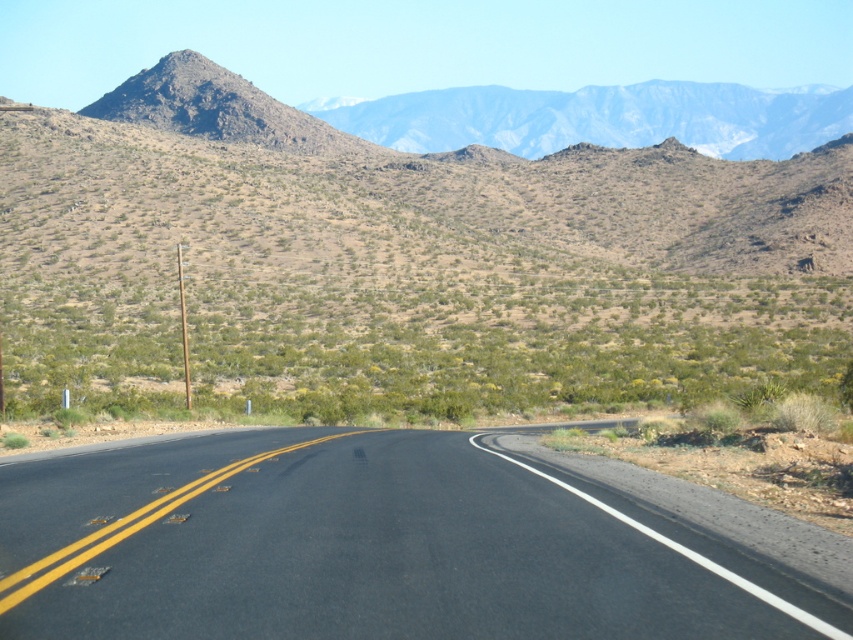
Question: Is black asphalt road at center below rugged rock mountain range at upper center?

Choices:
 (A) no
 (B) yes

Answer: (B)

Question: Which point is closer to the camera taking this photo?

Choices:
 (A) (119, 604)
 (B) (254, 88)

Answer: (A)

Question: Which point is closer to the camera taking this photo?

Choices:
 (A) (283, 532)
 (B) (178, 97)

Answer: (A)

Question: Among these points, which one is farthest from the camera?

Choices:
 (A) (206, 122)
 (B) (374, 556)

Answer: (A)

Question: Does black asphalt road at center have a greater width compared to rugged rock mountain range at upper center?

Choices:
 (A) no
 (B) yes

Answer: (A)

Question: Does black asphalt road at center have a smaller size compared to rugged rock mountain range at upper center?

Choices:
 (A) no
 (B) yes

Answer: (B)